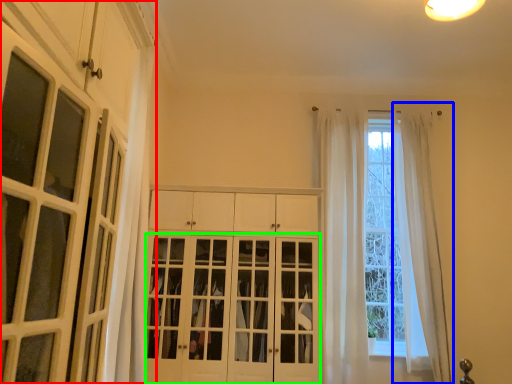
Question: Estimate the real-world distances between objects in this image. Which object is farther from cabinetry (highlighted by a red box), curtain (highlighted by a blue box) or door (highlighted by a green box)?

Choices:
 (A) curtain
 (B) door

Answer: (A)